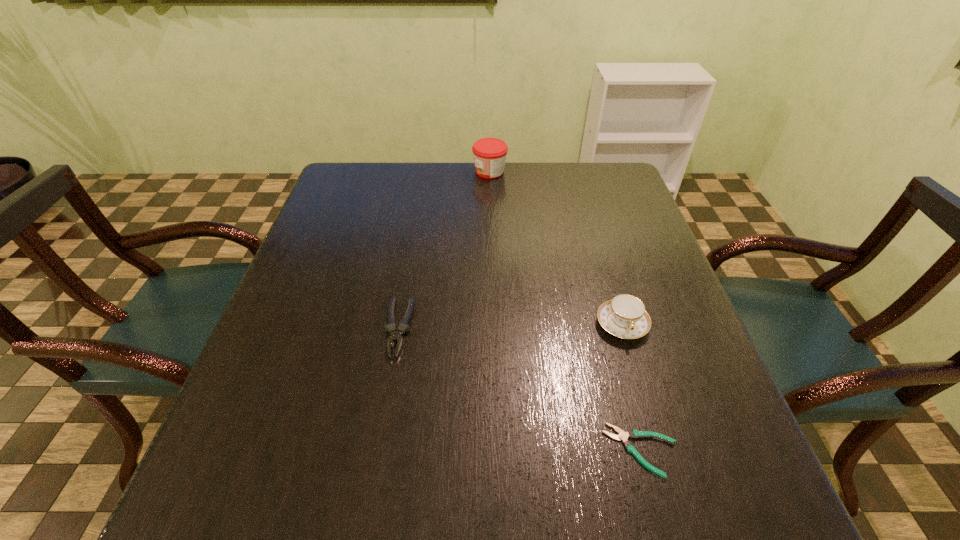
In order to click on free spot at the left edge of the desktop in this screenshot , I will do tap(321, 232).

Locate an element on the screen. vacant space at the right edge of the desktop is located at coordinates (630, 212).

This screenshot has width=960, height=540. Find the location of `free space at the far right corner`. free space at the far right corner is located at coordinates (605, 174).

Identify the location of vacant position at the near right corner of the desktop. (698, 522).

This screenshot has height=540, width=960. I want to click on free point between the taller pliers and the jam, so [x=444, y=249].

Where is `vacant point located between the leftmost object and the jam`? The width and height of the screenshot is (960, 540). vacant point located between the leftmost object and the jam is located at coordinates (444, 249).

Locate an element on the screen. The height and width of the screenshot is (540, 960). vacant area that lies between the second tallest object and the third tallest object is located at coordinates (511, 326).

What are the coordinates of `blank region between the farther pliers and the teacup` in the screenshot? It's located at (511, 326).

This screenshot has height=540, width=960. Find the location of `free space between the farther pliers and the nearer pliers`. free space between the farther pliers and the nearer pliers is located at coordinates (520, 389).

In order to click on vacant area that lies between the taller pliers and the teacup in this screenshot , I will do `click(511, 326)`.